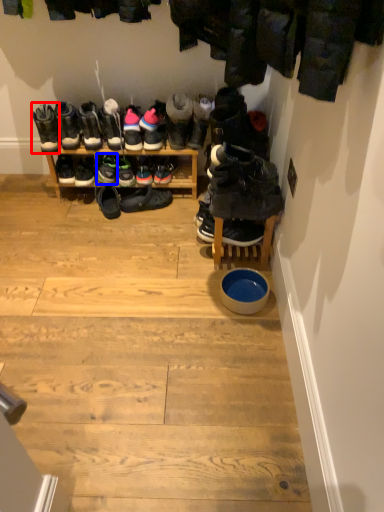
Question: Among these objects, which one is farthest to the camera, footwear (highlighted by a red box) or footwear (highlighted by a blue box)?

Choices:
 (A) footwear
 (B) footwear

Answer: (B)